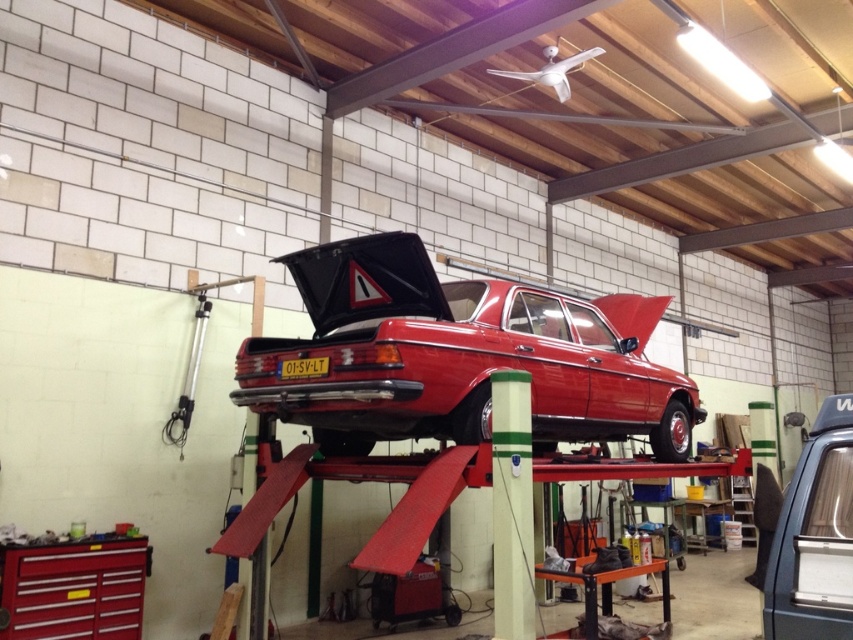
Question: Which point is farther from the camera taking this photo?

Choices:
 (A) (300, 340)
 (B) (801, 586)

Answer: (A)

Question: Considering the relative positions of glossy red car at center and metallic gray car at center in the image provided, where is glossy red car at center located with respect to metallic gray car at center?

Choices:
 (A) above
 (B) below

Answer: (A)

Question: Which point is closer to the camera taking this photo?

Choices:
 (A) (498, 291)
 (B) (842, 577)

Answer: (B)

Question: Is glossy red car at center above metallic gray car at center?

Choices:
 (A) yes
 (B) no

Answer: (A)

Question: From the image, what is the correct spatial relationship of glossy red car at center in relation to metallic gray car at center?

Choices:
 (A) above
 (B) below

Answer: (A)